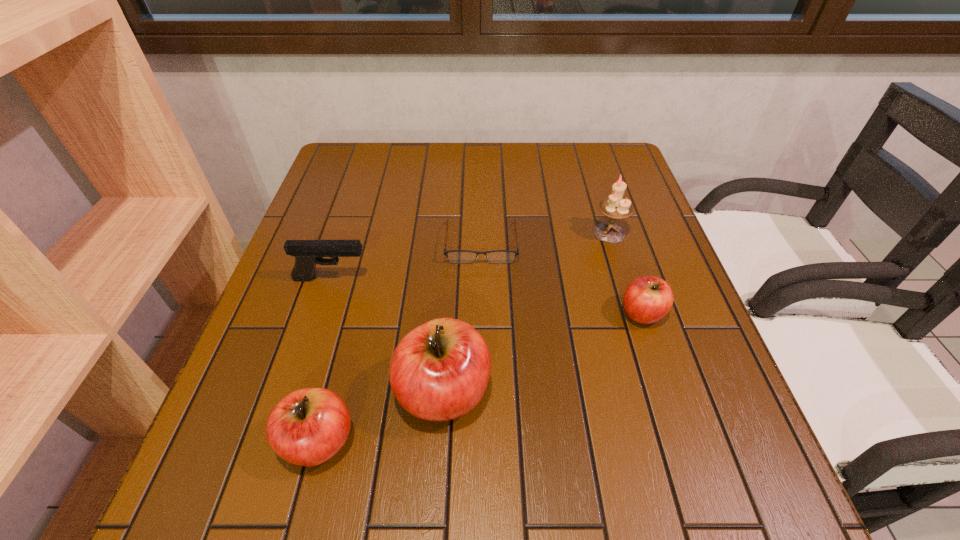
This screenshot has width=960, height=540. What are the coordinates of `vacant position at the left edge of the desktop` in the screenshot? It's located at (280, 369).

The width and height of the screenshot is (960, 540). In order to click on vacant space at the right edge of the desktop in this screenshot , I will do `click(658, 252)`.

Locate an element on the screen. The image size is (960, 540). vacant region at the far left corner of the desktop is located at coordinates (353, 144).

Locate an element on the screen. The width and height of the screenshot is (960, 540). free space at the near right corner is located at coordinates (689, 434).

At what (x,y) coordinates should I click in order to perform the action: click on free space between the shortest object and the tallest apple. Please return your answer as a coordinate pair (x, y). Looking at the image, I should click on (463, 317).

Locate an element on the screen. Image resolution: width=960 pixels, height=540 pixels. vacant space that is in between the leftmost apple and the shortest object is located at coordinates (400, 342).

Locate an element on the screen. Image resolution: width=960 pixels, height=540 pixels. vacant point located between the second apple from left to right and the shortest object is located at coordinates point(463,317).

Find the location of a particular element. This screenshot has height=540, width=960. free space between the second apple from left to right and the pistol is located at coordinates (388, 335).

The image size is (960, 540). I want to click on free space between the pistol and the second apple from right to left, so click(x=388, y=335).

The image size is (960, 540). I want to click on empty space between the second apple from left to right and the second tallest apple, so click(x=381, y=417).